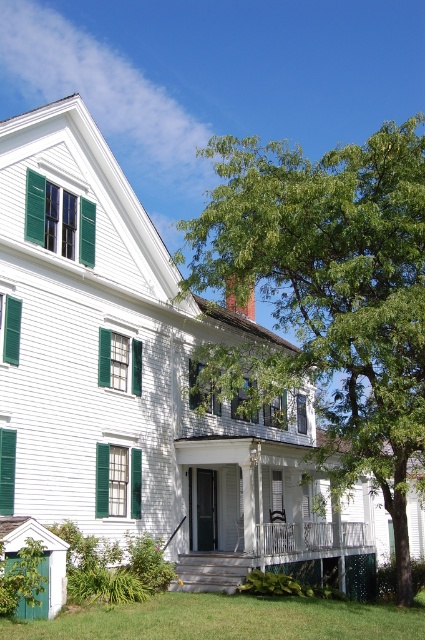
Measure the distance between green leafy tree at center and camera.

green leafy tree at center is 25.81 meters from camera.

Between point (337, 243) and point (263, 637), which one is positioned behind?

Positioned behind is point (337, 243).

Who is more distant from viewer, (328, 272) or (419, 596)?

The point (419, 596) is behind.

Locate an element on the screen. green leafy tree at center is located at coordinates (328, 298).

Can you confirm if green matte shutter at lower left is positioned to the left of green matte shutter at left?

In fact, green matte shutter at lower left is to the right of green matte shutter at left.

Who is positioned more to the right, green matte shutter at lower left or green matte shutter at left?

Positioned to the right is green matte shutter at lower left.

What are the coordinates of `green matte shutter at lower left` in the screenshot? It's located at (6, 468).

Consider the image. Who is more forward, (235, 305) or (280, 490)?

Positioned in front is point (280, 490).

Between point (226, 298) and point (280, 472), which one is positioned behind?

The point (226, 298) is behind.

Does point (226, 284) lie behind point (275, 492)?

That is False.

I want to click on red brick chimney at center, so (x=235, y=301).